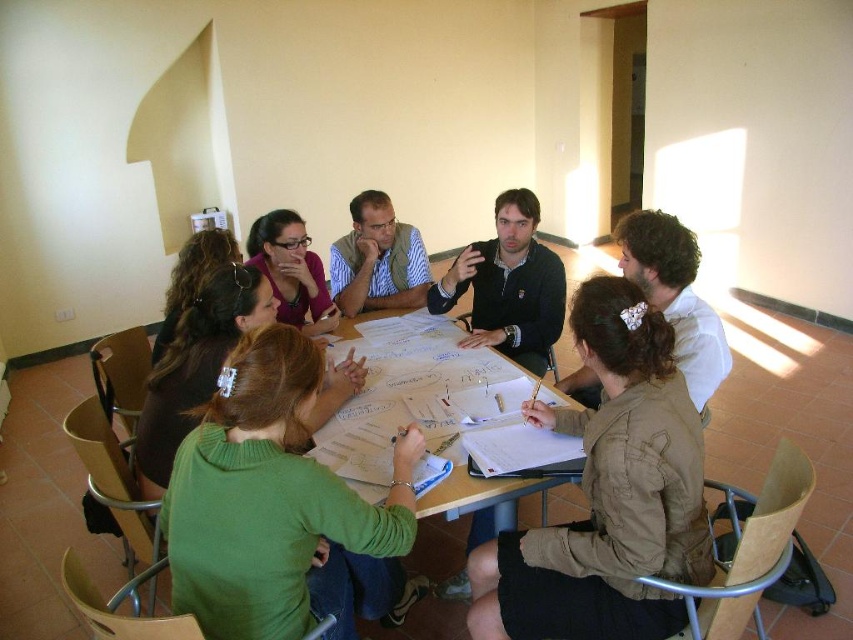
You are organizing a photo shoot and need to decide which participant to feature based on their clothing. Given the brown quilted jacket at center and the striped fabric shirt at center, which clothing item would you choose if you want to highlight a larger garment?

The brown quilted jacket at center has a larger size compared to the striped fabric shirt at center, so it would be the better choice to highlight a larger garment.

Based on the photo, you are standing in the classroom and want to hand a document to the person wearing the brown quilted jacket at center and the striped fabric shirt at center. Which one can you reach without moving from your current position?

The brown quilted jacket at center is closer to the viewer than the striped fabric shirt at center, so you can reach the person wearing the brown quilted jacket at center without moving.